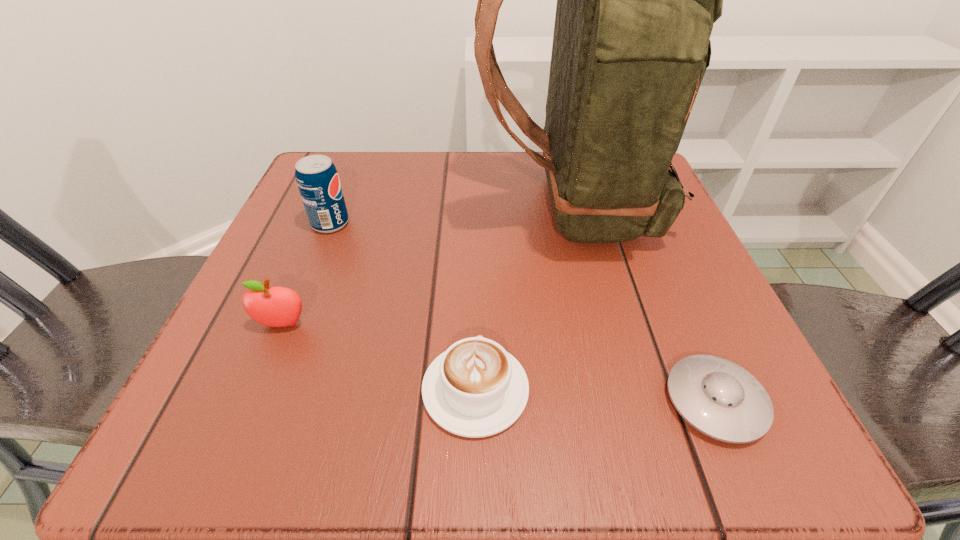
Where is `backpack`? backpack is located at coordinates coord(636,0).

Locate an element on the screen. The width and height of the screenshot is (960, 540). pop is located at coordinates (317, 179).

Find the location of a particular element. the third farthest object is located at coordinates (271, 306).

Identify the location of apple. (271, 306).

In order to click on cappuccino in this screenshot , I will do `click(474, 389)`.

You are a GUI agent. You are given a task and a screenshot of the screen. Output one action in this format:
    pyautogui.click(x=<x>, y=<y>)
    Task: Click on the shortest object
    The image size is (960, 540).
    Given the screenshot: What is the action you would take?
    tap(719, 398)

Where is `vacant space located 0.270m on the back of the backpack`? Image resolution: width=960 pixels, height=540 pixels. vacant space located 0.270m on the back of the backpack is located at coordinates (337, 207).

The width and height of the screenshot is (960, 540). I want to click on vacant region located on the back of the backpack, so click(x=352, y=207).

In order to click on free region located on the back of the backpack in this screenshot , I will do `click(404, 207)`.

This screenshot has width=960, height=540. What are the coordinates of `blank space located on the front of the second tallest object` in the screenshot? It's located at (261, 397).